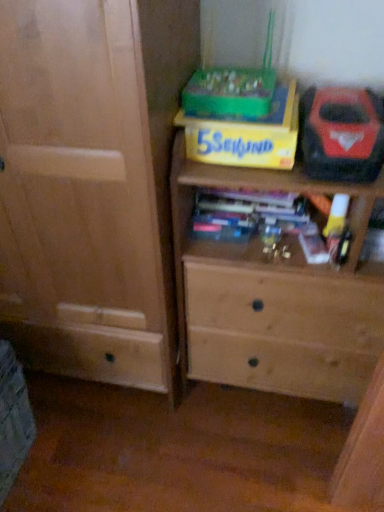
Describe the element at coordinates (246, 135) in the screenshot. I see `yellow cardboard box at upper center` at that location.

I want to click on light brown wood chest of drawers at center, so click(x=285, y=322).

Can you confirm if red plastic tool at upper right is wider than light brown wood chest of drawers at center?

No, red plastic tool at upper right is not wider than light brown wood chest of drawers at center.

Is light brown wood chest of drawers at center completely or partially inside red plastic tool at upper right?

Definitely not — light brown wood chest of drawers at center is not inside red plastic tool at upper right.

You are a GUI agent. You are given a task and a screenshot of the screen. Output one action in this format:
    pyautogui.click(x=<x>, y=<y>)
    Task: Click on the chest of drawers to the left of red plastic tool at upper right
    The width and height of the screenshot is (384, 512).
    Given the screenshot: What is the action you would take?
    [x=285, y=322]

Does red plastic tool at upper right come behind light brown wood chest of drawers at center?

Yes, it is.

Looking at this image, is yellow cardboard box at upper center facing away from red plastic tool at upper right?

No.

Who is smaller, yellow cardboard box at upper center or red plastic tool at upper right?

yellow cardboard box at upper center is smaller.

Is point (203, 158) positioned in front of point (316, 115)?

No, it is behind (316, 115).

Based on the photo, from the image's perspective, is yellow cardboard box at upper center under red plastic tool at upper right?

Actually, yellow cardboard box at upper center appears above red plastic tool at upper right in the image.

Who is shorter, light brown wood chest of drawers at center or yellow cardboard box at upper center?

With less height is yellow cardboard box at upper center.

Who is smaller, light brown wood chest of drawers at center or yellow cardboard box at upper center?

yellow cardboard box at upper center.

What are the coordinates of `the chest of drawers in front of the yellow cardboard box at upper center` in the screenshot? It's located at (285, 322).

From the image's perspective, is light brown wood chest of drawers at center below yellow cardboard box at upper center?

Indeed, from the image's perspective, light brown wood chest of drawers at center is shown beneath yellow cardboard box at upper center.

Consider the image. From a real-world perspective, is light brown wood chest of drawers at center positioned under red plastic tool at upper right based on gravity?

Yes, from a real-world perspective, light brown wood chest of drawers at center is under red plastic tool at upper right.

Considering the relative sizes of light brown wood chest of drawers at center and red plastic tool at upper right in the image provided, is light brown wood chest of drawers at center wider than red plastic tool at upper right?

Yes.

Is light brown wood chest of drawers at center not close to red plastic tool at upper right?

No, light brown wood chest of drawers at center is not far away from red plastic tool at upper right.

Where is `kit above the light brown wood chest of drawers at center (from a real-world perspective)`? The image size is (384, 512). kit above the light brown wood chest of drawers at center (from a real-world perspective) is located at coordinates (342, 134).

Is yellow cardboard box at upper center at the back of red plastic tool at upper right?

red plastic tool at upper right does not have its back to yellow cardboard box at upper center.

Between red plastic tool at upper right and yellow cardboard box at upper center, which one has smaller size?

→ Smaller between the two is yellow cardboard box at upper center.

Would you say red plastic tool at upper right is a long distance from yellow cardboard box at upper center?

No.

Is yellow cardboard box at upper center facing towards light brown wood chest of drawers at center?

Yes.

Can you confirm if yellow cardboard box at upper center is wider than light brown wood chest of drawers at center?

Incorrect, the width of yellow cardboard box at upper center does not surpass that of light brown wood chest of drawers at center.

In the image, there is a light brown wood chest of drawers at center. At what (x,y) coordinates should I click in order to perform the action: click on cardboard box above it (from the image's perspective). Please return your answer as a coordinate pair (x, y). The image size is (384, 512). Looking at the image, I should click on (246, 135).

Considering the relative sizes of yellow cardboard box at upper center and light brown wood chest of drawers at center in the image provided, is yellow cardboard box at upper center smaller than light brown wood chest of drawers at center?

Yes.

Find the location of a particular element. chest of drawers located on the left of red plastic tool at upper right is located at coordinates (285, 322).

You are a GUI agent. You are given a task and a screenshot of the screen. Output one action in this format:
    pyautogui.click(x=<x>, y=<y>)
    Task: Click on the kit above the yellow cardboard box at upper center (from a real-world perspective)
    The width and height of the screenshot is (384, 512).
    Given the screenshot: What is the action you would take?
    pyautogui.click(x=342, y=134)

Looking at the image, which one is located closer to light brown wood chest of drawers at center, red plastic tool at upper right or yellow cardboard box at upper center?

yellow cardboard box at upper center lies closer to light brown wood chest of drawers at center than the other object.

From the image, which object appears to be farther from yellow cardboard box at upper center, red plastic tool at upper right or light brown wood chest of drawers at center?

light brown wood chest of drawers at center is further to yellow cardboard box at upper center.

Which object lies further to the anchor point light brown wood chest of drawers at center, yellow cardboard box at upper center or red plastic tool at upper right?

red plastic tool at upper right lies further to light brown wood chest of drawers at center than the other object.

Consider the image. When comparing their distances from yellow cardboard box at upper center, does light brown wood chest of drawers at center or red plastic tool at upper right seem closer?

red plastic tool at upper right.

When comparing their distances from red plastic tool at upper right, does light brown wood chest of drawers at center or yellow cardboard box at upper center seem further?

light brown wood chest of drawers at center.

Estimate the real-world distances between objects in this image. Which object is further from red plastic tool at upper right, yellow cardboard box at upper center or light brown wood chest of drawers at center?

light brown wood chest of drawers at center is further to red plastic tool at upper right.

Locate an element on the screen. The image size is (384, 512). kit between yellow cardboard box at upper center and light brown wood chest of drawers at center in the vertical direction is located at coordinates (342, 134).